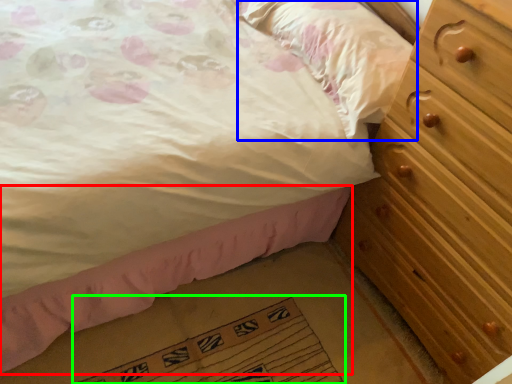
Question: Considering the real-world distances, which object is farthest from bed frame (highlighted by a red box)? pillow (highlighted by a blue box) or doormat (highlighted by a green box)?

Choices:
 (A) pillow
 (B) doormat

Answer: (A)